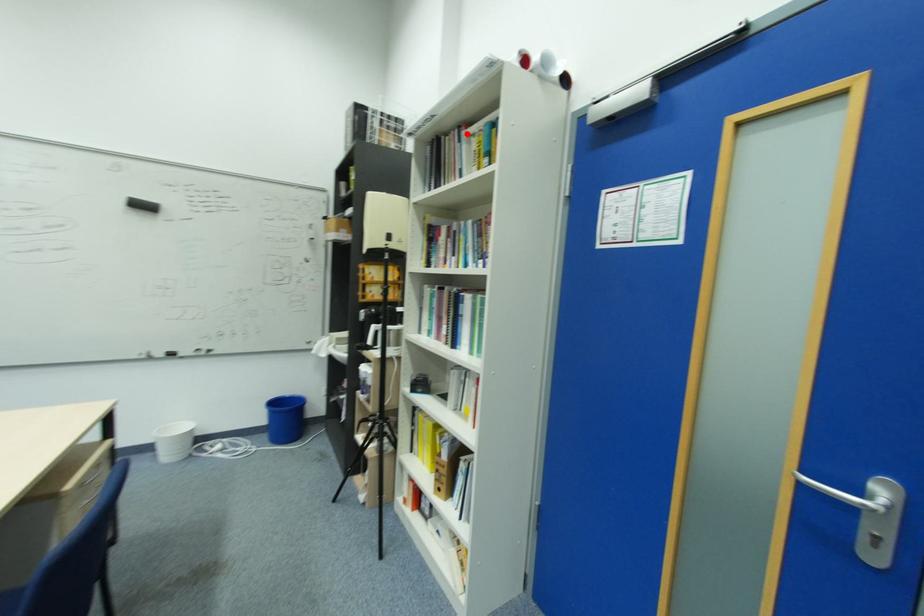
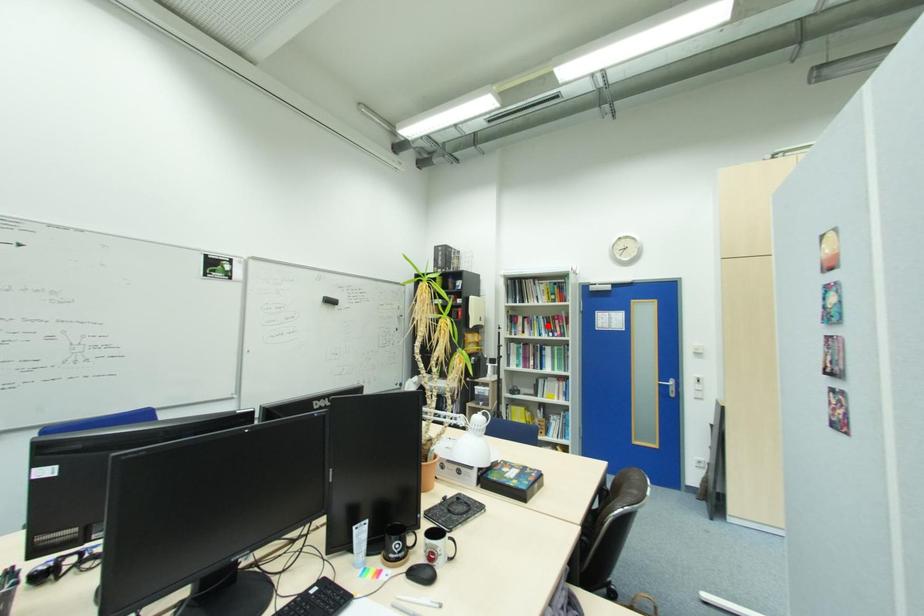
I am providing you with two images of the same scene from different viewpoints. A red point is marked on the first image and another point is marked on the second image. Is the marked point in image1 the same physical position as the marked point in image2?

No